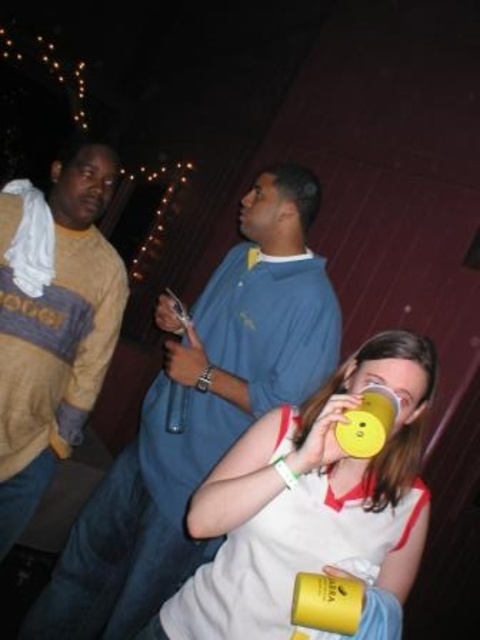
Who is more forward, [348,616] or [384,428]?

Point [348,616] is more forward.

Which is more to the right, yellow matte cup at lower right or yellow matte cup at lower center?

From the viewer's perspective, yellow matte cup at lower center appears more on the right side.

Where is `yellow matte cup at lower right`? This screenshot has width=480, height=640. yellow matte cup at lower right is located at coordinates (327, 602).

This screenshot has height=640, width=480. What are the coordinates of `yellow matte cup at lower right` in the screenshot? It's located at (327, 602).

Which is in front, point (216, 365) or point (369, 397)?

Point (369, 397) is in front.

Between matte blue shirt at center and yellow matte cup at lower center, which one appears on the right side from the viewer's perspective?

yellow matte cup at lower center

This screenshot has height=640, width=480. I want to click on matte blue shirt at center, so tap(199, 413).

Does point (6, 442) lie in front of point (339, 600)?

No, (6, 442) is further to viewer.

The height and width of the screenshot is (640, 480). I want to click on beige sweater at left, so click(x=52, y=323).

At what (x,y) coordinates should I click in order to perform the action: click on beige sweater at left. Please return your answer as a coordinate pair (x, y). Image resolution: width=480 pixels, height=640 pixels. Looking at the image, I should click on (52, 323).